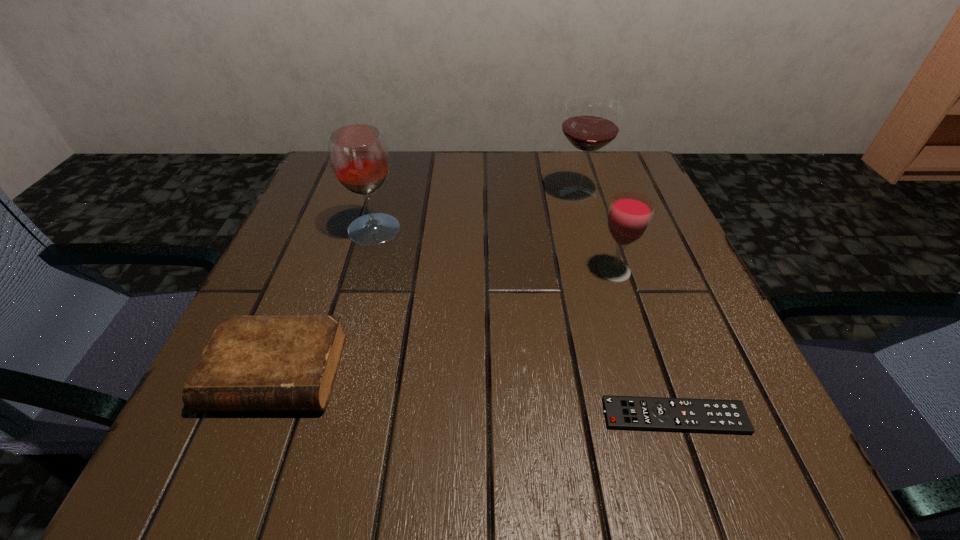
At what (x,y) coordinates should I click in order to perform the action: click on vacant position located on the spine side of the diary. Please return your answer as a coordinate pair (x, y). Looking at the image, I should click on click(x=239, y=469).

Image resolution: width=960 pixels, height=540 pixels. Identify the location of vacant space located on the left of the remote control. (337, 416).

At what (x,y) coordinates should I click in order to perform the action: click on object that is at the far edge. Please return your answer as a coordinate pair (x, y). The image size is (960, 540). Looking at the image, I should click on (591, 123).

Where is `diary situated at the near edge`? diary situated at the near edge is located at coordinates (251, 363).

At what (x,y) coordinates should I click in order to perform the action: click on remote control that is at the near edge. Please return your answer as a coordinate pair (x, y). Image resolution: width=960 pixels, height=540 pixels. Looking at the image, I should click on (716, 416).

Locate an element on the screen. wineglass that is at the left edge is located at coordinates (x=359, y=159).

Identify the location of diary at the left edge. (251, 363).

The height and width of the screenshot is (540, 960). Identify the location of remote control located in the right edge section of the desktop. (716, 416).

Identify the location of object positioned at the near left corner. (251, 363).

Locate an element on the screen. The width and height of the screenshot is (960, 540). object that is at the far right corner is located at coordinates (591, 123).